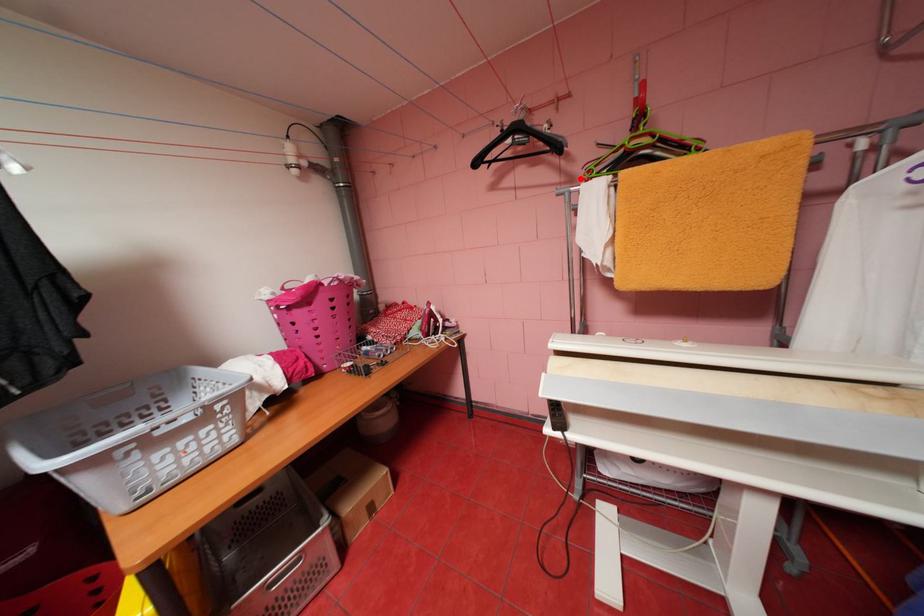
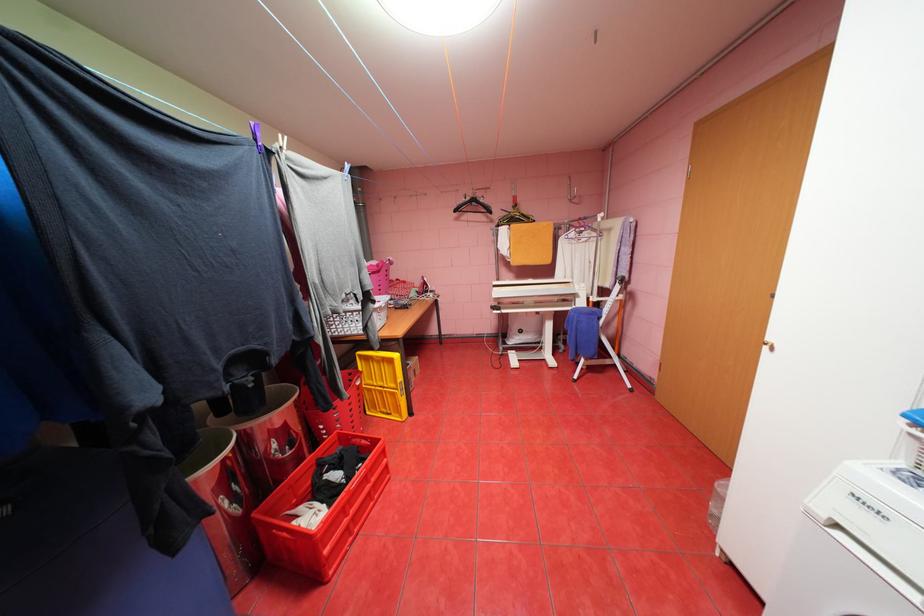
In the second image, find the point that corresponds to the highlighted location in the first image.

(500, 221)